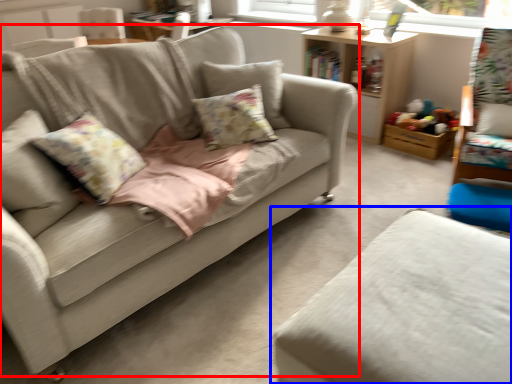
Question: Among these objects, which one is nearest to the camera, studio couch (highlighted by a red box) or studio couch (highlighted by a blue box)?

Choices:
 (A) studio couch
 (B) studio couch

Answer: (B)